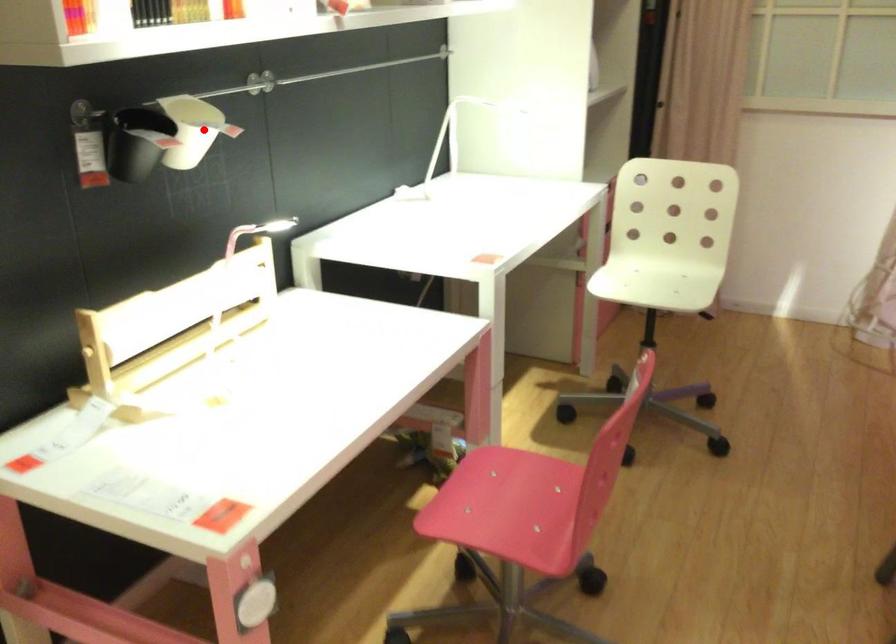
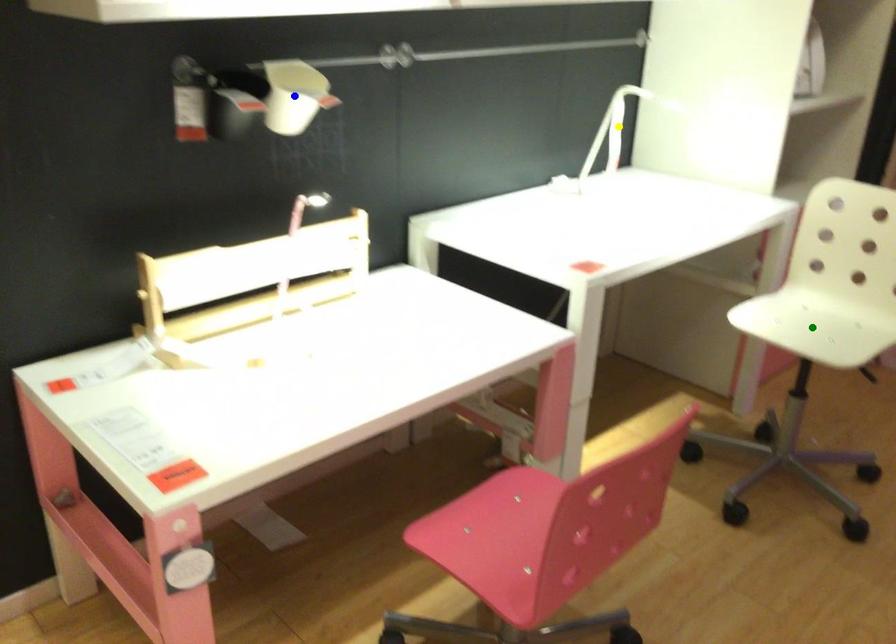
Question: I am providing you with two images of the same scene from different viewpoints. A red point is marked on the first image. You are given multiple points on the second image. In image 2, which mark is for the same physical point as the one in image 1?

Choices:
 (A) yellow point
 (B) blue point
 (C) green point

Answer: (B)